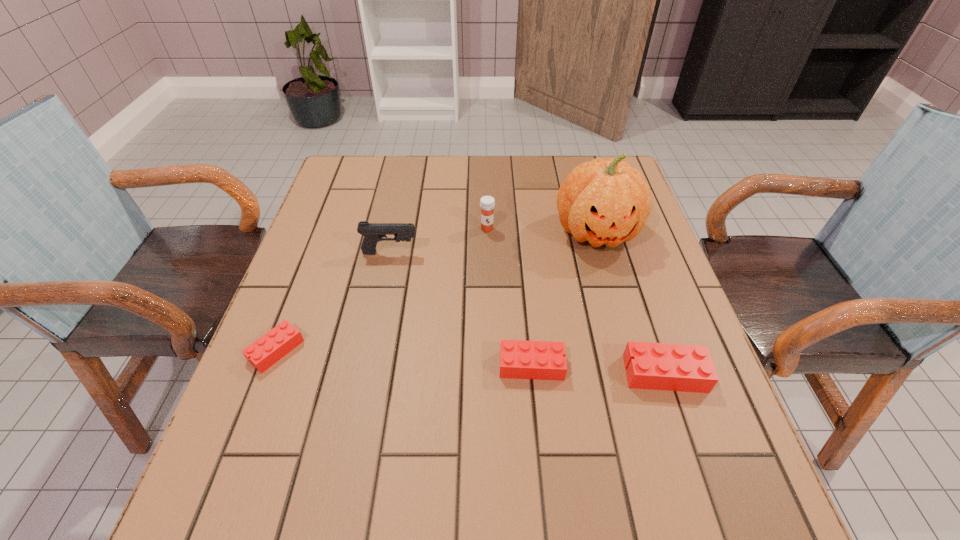
Please point a location where one more Lego can be added evenly. Please provide its 2D coordinates. Your answer should be formatted as a tuple, i.e. [(x, y)], where the tuple contains the x and y coordinates of a point satisfying the conditions above.

[(402, 358)]